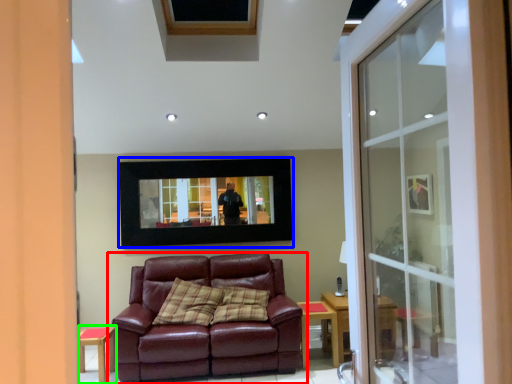
Question: Which object is the farthest from studio couch (highlighted by a red box)? Choose among these: picture frame (highlighted by a blue box) or side table (highlighted by a green box).

Choices:
 (A) picture frame
 (B) side table

Answer: (A)